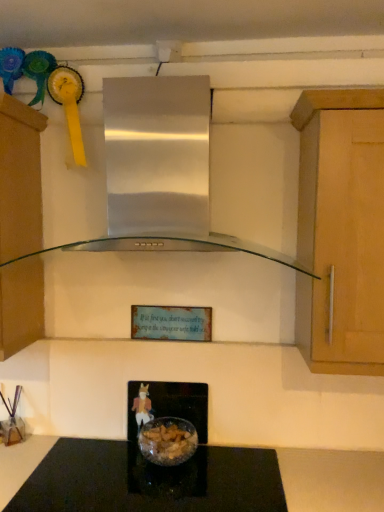
Question: Does black glass countertop at center turn towards stainless steel range hood at center?

Choices:
 (A) no
 (B) yes

Answer: (A)

Question: From the image's perspective, would you say black glass countertop at center is positioned over stainless steel range hood at center?

Choices:
 (A) no
 (B) yes

Answer: (A)

Question: Is black glass countertop at center behind stainless steel range hood at center?

Choices:
 (A) yes
 (B) no

Answer: (A)

Question: Is black glass countertop at center placed right next to stainless steel range hood at center?

Choices:
 (A) yes
 (B) no

Answer: (B)

Question: Does black glass countertop at center have a greater width compared to stainless steel range hood at center?

Choices:
 (A) yes
 (B) no

Answer: (B)

Question: From a real-world perspective, is stainless steel range hood at center physically located above or below matte brown cabinet at left?

Choices:
 (A) below
 (B) above

Answer: (B)

Question: Visually, is stainless steel range hood at center positioned to the left or to the right of matte brown cabinet at left?

Choices:
 (A) right
 (B) left

Answer: (A)

Question: Is stainless steel range hood at center taller or shorter than matte brown cabinet at left?

Choices:
 (A) tall
 (B) short

Answer: (B)

Question: Is stainless steel range hood at center spatially inside matte brown cabinet at left, or outside of it?

Choices:
 (A) inside
 (B) outside

Answer: (B)

Question: From a real-world perspective, relative to translucent glass bowl at center, is black glass countertop at center vertically above or below?

Choices:
 (A) below
 (B) above

Answer: (A)

Question: Is black glass countertop at center wider or thinner than translucent glass bowl at center?

Choices:
 (A) wide
 (B) thin

Answer: (A)

Question: Would you say black glass countertop at center is inside or outside translucent glass bowl at center?

Choices:
 (A) outside
 (B) inside

Answer: (A)

Question: Considering the positions of black glass countertop at center and translucent glass bowl at center in the image, is black glass countertop at center taller or shorter than translucent glass bowl at center?

Choices:
 (A) short
 (B) tall

Answer: (A)

Question: Is translucent glass bowl at center to the left or to the right of stainless steel range hood at center in the image?

Choices:
 (A) right
 (B) left

Answer: (A)

Question: In terms of height, does translucent glass bowl at center look taller or shorter compared to stainless steel range hood at center?

Choices:
 (A) short
 (B) tall

Answer: (A)